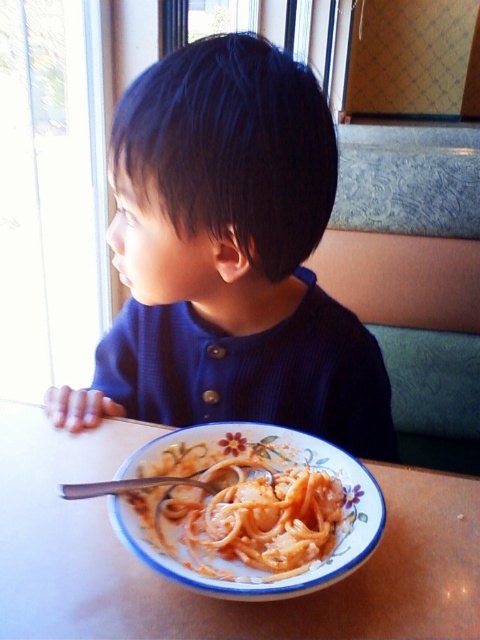
Is dark blue sweater at upper left below creamy matte pasta at lower center?

Actually, dark blue sweater at upper left is above creamy matte pasta at lower center.

In the scene shown: Between dark blue sweater at upper left and creamy matte pasta at lower center, which one has less height?

Standing shorter between the two is creamy matte pasta at lower center.

Find the location of a particular element. dark blue sweater at upper left is located at coordinates (228, 257).

The width and height of the screenshot is (480, 640). In order to click on dark blue sweater at upper left in this screenshot , I will do `click(228, 257)`.

Does dark blue sweater at upper left have a greater width compared to white glossy table at lower center?

Incorrect, dark blue sweater at upper left's width does not surpass white glossy table at lower center's.

Is point (205, 212) behind point (384, 536)?

No, it is in front of (384, 536).

Locate an element on the screen. This screenshot has width=480, height=640. dark blue sweater at upper left is located at coordinates (228, 257).

Between dark blue sweater at upper left and silver metallic fork at lower center, which one has more height?

dark blue sweater at upper left

Is dark blue sweater at upper left smaller than silver metallic fork at lower center?

Actually, dark blue sweater at upper left might be larger than silver metallic fork at lower center.

Which is in front, point (264, 308) or point (264, 476)?

Point (264, 476)

Image resolution: width=480 pixels, height=640 pixels. What are the coordinates of `dark blue sweater at upper left` in the screenshot? It's located at (228, 257).